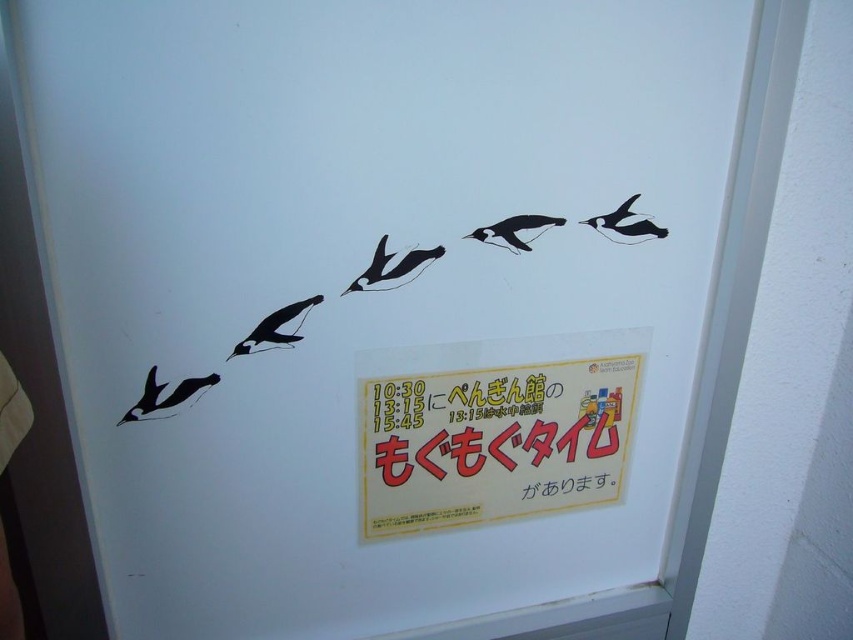
Which is below, yellow paper sign at center or black glossy penguin at upper left?

yellow paper sign at center

In the scene shown: Can you confirm if yellow paper sign at center is bigger than black glossy penguin at upper left?

Correct, yellow paper sign at center is larger in size than black glossy penguin at upper left.

Does point (531, 436) come farther from viewer compared to point (244, 348)?

Yes, it is.

Find the location of a particular element. yellow paper sign at center is located at coordinates (491, 428).

Can you confirm if black glossy penguin at upper center is positioned above black glossy penguin at lower left?

Correct, black glossy penguin at upper center is located above black glossy penguin at lower left.

Who is more forward, (x=486, y=227) or (x=175, y=401)?

Point (x=175, y=401) is in front.

Between point (489, 230) and point (202, 385), which one is positioned in front?

Positioned in front is point (202, 385).

Find the location of a particular element. Image resolution: width=853 pixels, height=640 pixels. black glossy penguin at upper center is located at coordinates (514, 228).

Can you confirm if black glossy penguin at center is shorter than black glossy penguin at upper right?

Incorrect, black glossy penguin at center's height does not fall short of black glossy penguin at upper right's.

Can you confirm if black glossy penguin at center is bigger than black glossy penguin at upper right?

Actually, black glossy penguin at center might be smaller than black glossy penguin at upper right.

At what (x,y) coordinates should I click in order to perform the action: click on black glossy penguin at center. Please return your answer as a coordinate pair (x, y). Looking at the image, I should click on (393, 266).